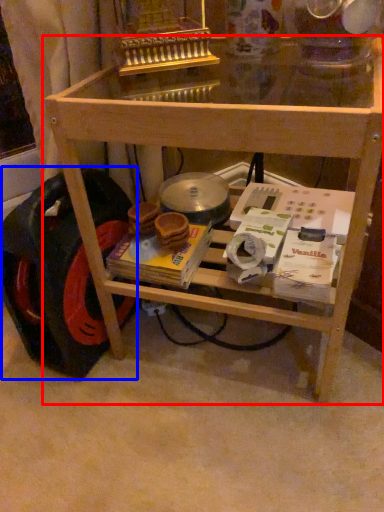
Question: Among these objects, which one is farthest to the camera, table (highlighted by a red box) or wheel (highlighted by a blue box)?

Choices:
 (A) table
 (B) wheel

Answer: (B)